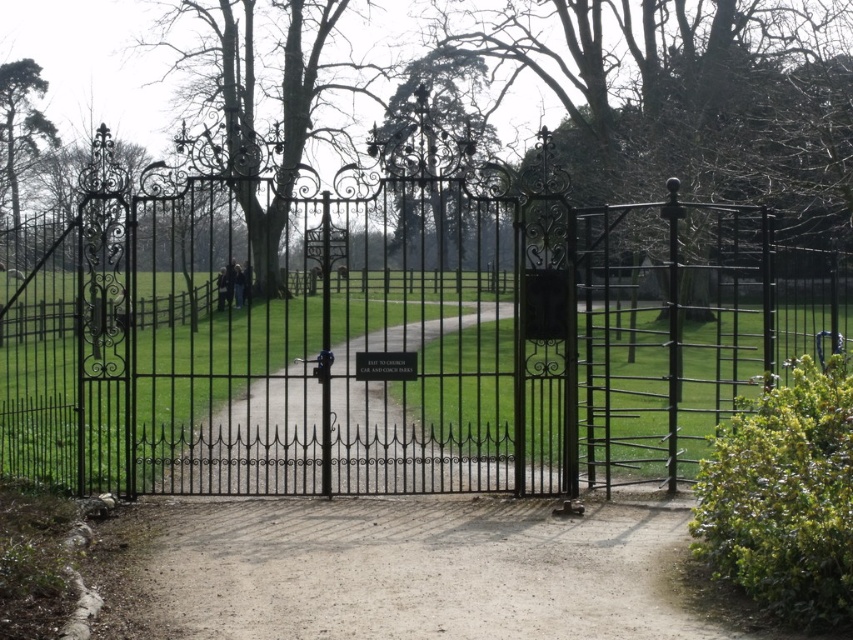
Can you confirm if black wrought iron gate at center is positioned to the left of dirt/gravel path at center?

Incorrect, black wrought iron gate at center is not on the left side of dirt/gravel path at center.

Does point (154, 282) come closer to viewer compared to point (288, 500)?

No, (154, 282) is behind (288, 500).

The width and height of the screenshot is (853, 640). What do you see at coordinates (393, 333) in the screenshot?
I see `black wrought iron gate at center` at bounding box center [393, 333].

The height and width of the screenshot is (640, 853). Find the location of `black wrought iron gate at center`. black wrought iron gate at center is located at coordinates (393, 333).